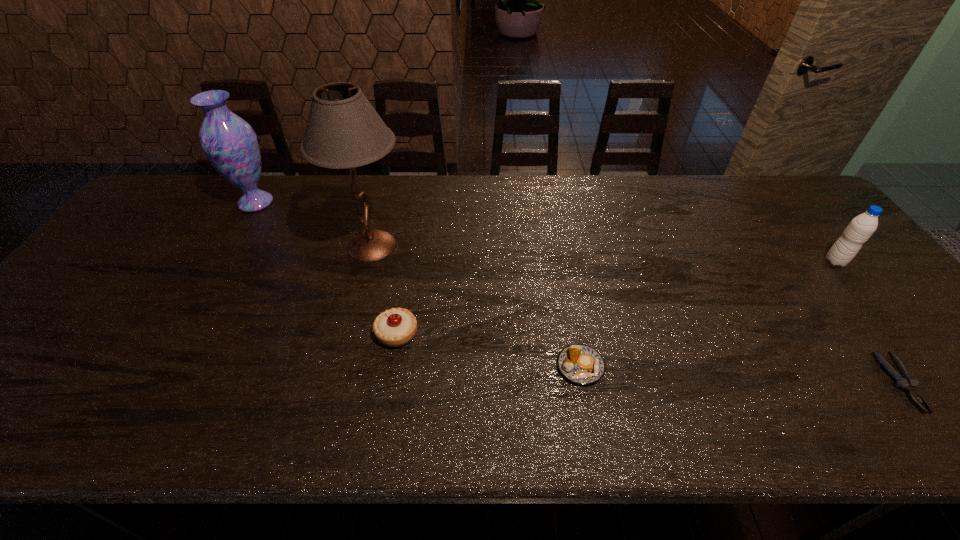
At what (x,y) coordinates should I click in order to perform the action: click on object that is at the near right corner. Please return your answer as a coordinate pair (x, y). This screenshot has width=960, height=540. Looking at the image, I should click on (907, 382).

The image size is (960, 540). I want to click on vacant space at the far edge of the desktop, so click(298, 180).

Identify the location of free region at the near edge. (904, 408).

Identify the location of free space at the left edge. (103, 267).

At what (x,y) coordinates should I click in order to perform the action: click on vacant space at the far right corner of the desktop. Please return your answer as a coordinate pair (x, y). Looking at the image, I should click on (789, 180).

Identify the location of vacant space that's between the right pastry and the table lamp. (476, 306).

Where is `vacant space that is in between the shortest object and the shorter pastry`? The height and width of the screenshot is (540, 960). vacant space that is in between the shortest object and the shorter pastry is located at coordinates (741, 375).

Find the location of a particular element. free space between the taller pastry and the table lamp is located at coordinates (384, 290).

Where is `free space between the fifth object from left to right and the fourth tallest object`? free space between the fifth object from left to right and the fourth tallest object is located at coordinates (649, 358).

Identify the location of empty space between the fifth object from left to right and the third tallest object. The image size is (960, 540). (869, 322).